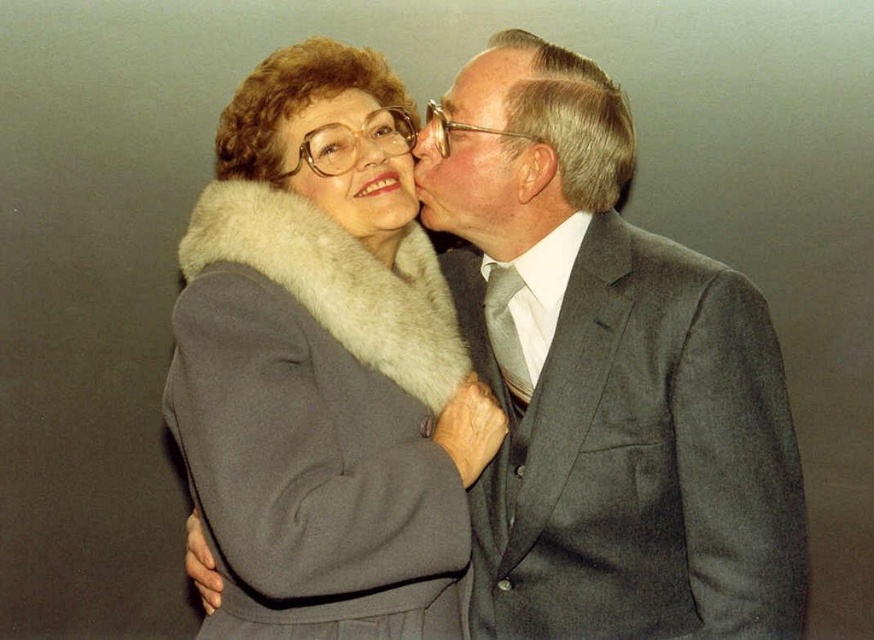
Question: Can you confirm if gray wool suit at center is positioned above gray wool coat with fur collar at center?

Choices:
 (A) no
 (B) yes

Answer: (A)

Question: Based on their relative distances, which object is nearer to the matte gray fur coat at upper center?

Choices:
 (A) gray wool coat with fur collar at center
 (B) gray wool suit at center
 (C) matte gray suit at center

Answer: (C)

Question: Is matte gray suit at center above matte gray fur coat at upper center?

Choices:
 (A) yes
 (B) no

Answer: (A)

Question: Among these points, which one is nearest to the camera?

Choices:
 (A) (214, 636)
 (B) (486, 179)
 (C) (357, 220)

Answer: (A)

Question: Does gray wool coat with fur collar at center have a lesser width compared to matte gray suit at center?

Choices:
 (A) no
 (B) yes

Answer: (A)

Question: Which point is farther to the camera?

Choices:
 (A) (496, 115)
 (B) (442, 484)
 (C) (614, 483)
 (D) (371, 192)

Answer: (D)